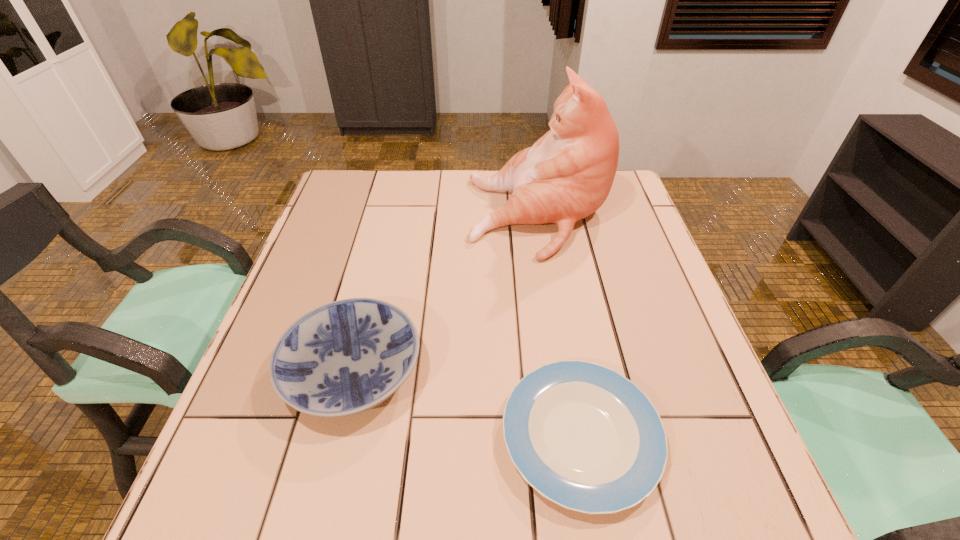
This screenshot has width=960, height=540. I want to click on vacant point at the left edge, so click(x=352, y=222).

This screenshot has height=540, width=960. Find the location of `vacant area at the right edge`. vacant area at the right edge is located at coordinates (610, 288).

I want to click on vacant area at the far left corner, so click(350, 210).

Locate an element on the screen. This screenshot has width=960, height=540. vacant space at the near right corner of the desktop is located at coordinates (667, 496).

The image size is (960, 540). I want to click on free space between the right plate and the cat, so click(x=560, y=327).

Identify the location of blank region between the farthest object and the left plate. The width and height of the screenshot is (960, 540). (446, 294).

You are a GUI agent. You are given a task and a screenshot of the screen. Output one action in this format:
    pyautogui.click(x=<x>, y=<y>)
    Task: Click on the free spot between the taller plate and the shortest object
    
    Given the screenshot: What is the action you would take?
    pyautogui.click(x=467, y=403)

Find the location of a particular element. The width and height of the screenshot is (960, 540). free space between the shortest object and the taller plate is located at coordinates (467, 403).

Locate an element on the screen. The width and height of the screenshot is (960, 540). empty space that is in between the right plate and the leftmost object is located at coordinates (467, 403).

What are the coordinates of `free spot between the farthest object and the right plate` in the screenshot? It's located at (560, 327).